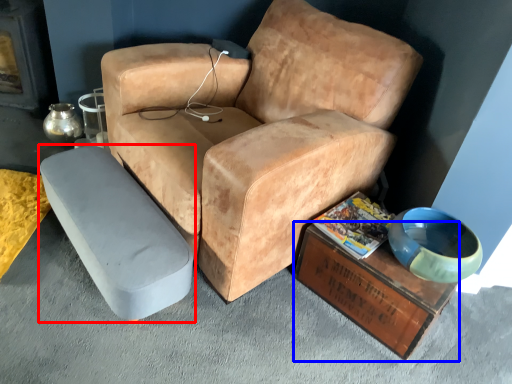
Question: Among these objects, which one is nearest to the camera, table (highlighted by a red box) or table (highlighted by a blue box)?

Choices:
 (A) table
 (B) table

Answer: (A)